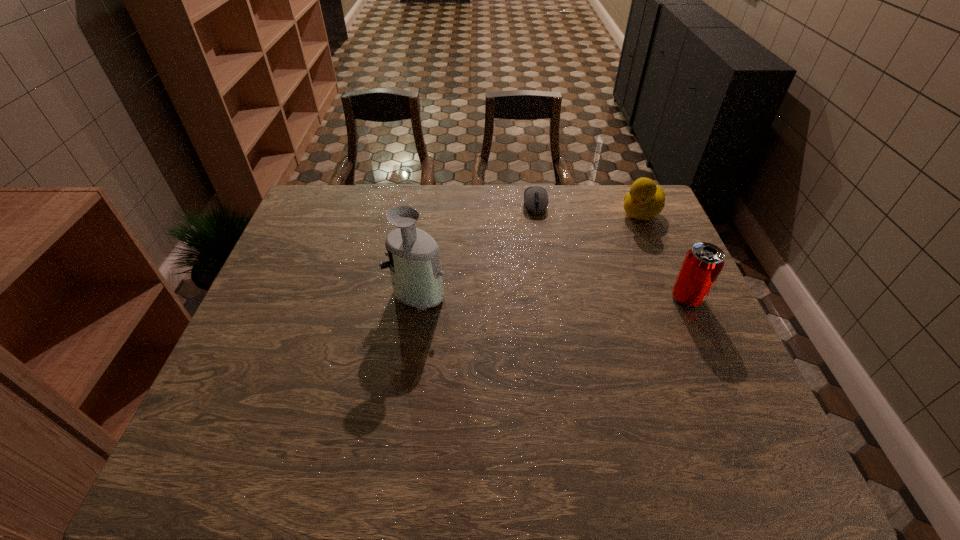
Locate an element on the screen. Image resolution: width=960 pixels, height=540 pixels. free space between the second object from left to right and the tallest object is located at coordinates (476, 248).

This screenshot has width=960, height=540. Find the location of `free point between the second shortest object and the tallest object`. free point between the second shortest object and the tallest object is located at coordinates (529, 252).

This screenshot has height=540, width=960. What are the coordinates of `unoccupied area between the computer equipment and the duck` in the screenshot? It's located at (588, 209).

The width and height of the screenshot is (960, 540). I want to click on vacant region between the third object from right to left and the second tallest object, so click(x=612, y=251).

The height and width of the screenshot is (540, 960). Identify the location of blank region between the second shortest object and the juicer. (529, 252).

Where is `blank region between the tallest object and the third object from right to left`? blank region between the tallest object and the third object from right to left is located at coordinates (476, 248).

Locate an element on the screen. Image resolution: width=960 pixels, height=540 pixels. the closest object to the tallest object is located at coordinates (535, 198).

Where is `the second closest object relative to the duck`? The height and width of the screenshot is (540, 960). the second closest object relative to the duck is located at coordinates (703, 263).

What are the coordinates of `free location that satisfies the following two spatial constraints: 1. on the front side of the third shortest object; 2. on the right side of the second object from left to right` in the screenshot? It's located at (549, 298).